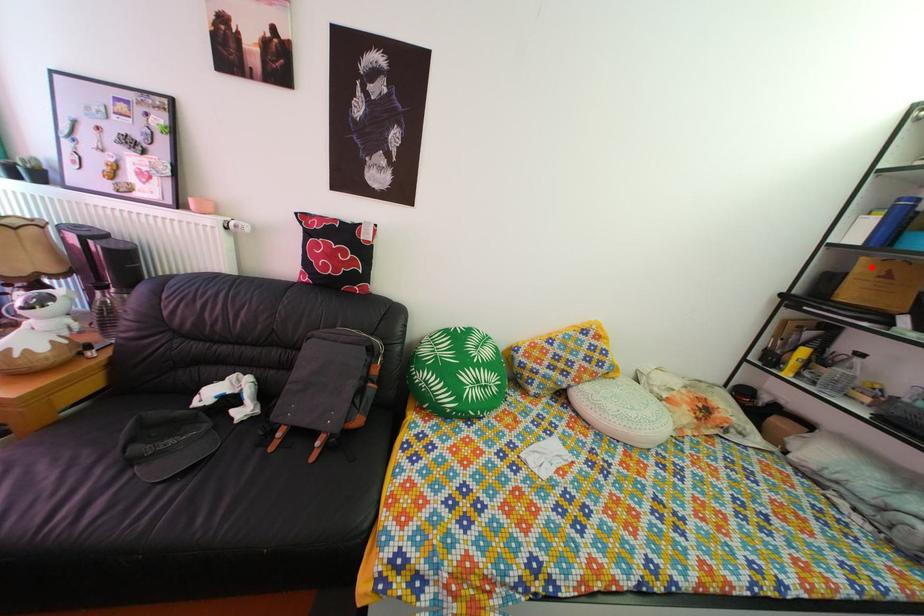
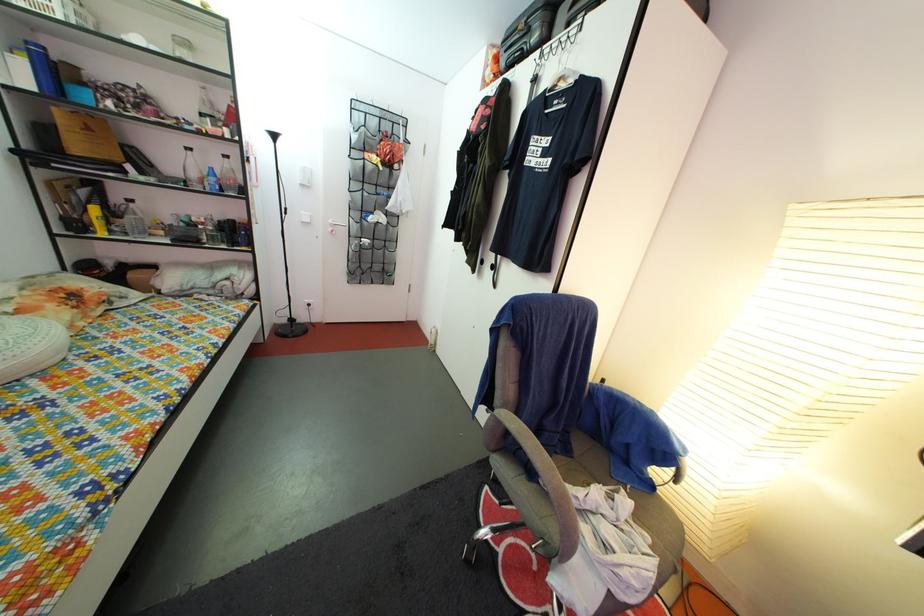
In the second image, find the point that corresponds to the highlighted location in the first image.

(64, 118)